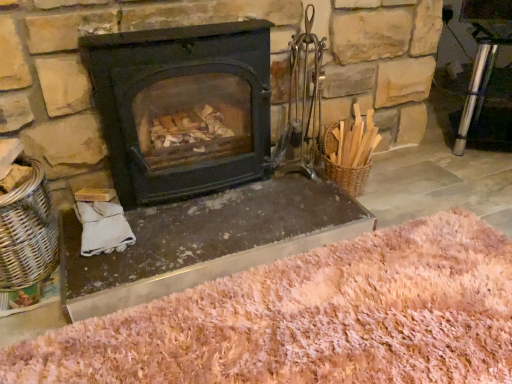
Question: Is matte black wood burning stove at center closer to camera compared to woven wicker basket at left?

Choices:
 (A) yes
 (B) no

Answer: (B)

Question: Does matte black wood burning stove at center have a greater width compared to woven wicker basket at left?

Choices:
 (A) yes
 (B) no

Answer: (B)

Question: Considering the relative sizes of matte black wood burning stove at center and woven wicker basket at left in the image provided, is matte black wood burning stove at center smaller than woven wicker basket at left?

Choices:
 (A) no
 (B) yes

Answer: (A)

Question: From the image's perspective, is matte black wood burning stove at center on top of woven wicker basket at left?

Choices:
 (A) no
 (B) yes

Answer: (B)

Question: Considering the relative positions of matte black wood burning stove at center and woven wicker basket at left in the image provided, is matte black wood burning stove at center to the left of woven wicker basket at left from the viewer's perspective?

Choices:
 (A) yes
 (B) no

Answer: (B)

Question: Considering their positions, is matte black wood burning stove at center located in front of or behind pink shaggy rug at lower center?

Choices:
 (A) behind
 (B) front

Answer: (A)

Question: Is point (161, 57) positioned closer to the camera than point (398, 271)?

Choices:
 (A) farther
 (B) closer

Answer: (A)

Question: In terms of width, does matte black wood burning stove at center look wider or thinner when compared to pink shaggy rug at lower center?

Choices:
 (A) wide
 (B) thin

Answer: (B)

Question: Is matte black wood burning stove at center bigger or smaller than pink shaggy rug at lower center?

Choices:
 (A) small
 (B) big

Answer: (B)

Question: Considering the positions of metallic gray fireplace at center and matte black wood burning stove at center in the image, is metallic gray fireplace at center bigger or smaller than matte black wood burning stove at center?

Choices:
 (A) big
 (B) small

Answer: (B)

Question: Would you say metallic gray fireplace at center is inside or outside matte black wood burning stove at center?

Choices:
 (A) outside
 (B) inside

Answer: (A)

Question: Is metallic gray fireplace at center to the left or to the right of matte black wood burning stove at center in the image?

Choices:
 (A) right
 (B) left

Answer: (A)

Question: From the image's perspective, relative to matte black wood burning stove at center, is metallic gray fireplace at center above or below?

Choices:
 (A) below
 (B) above

Answer: (A)

Question: In the image, is pink shaggy rug at lower center positioned in front of or behind woven wicker basket at left?

Choices:
 (A) front
 (B) behind

Answer: (A)

Question: Is point (416, 352) closer or farther from the camera than point (25, 264)?

Choices:
 (A) closer
 (B) farther

Answer: (A)